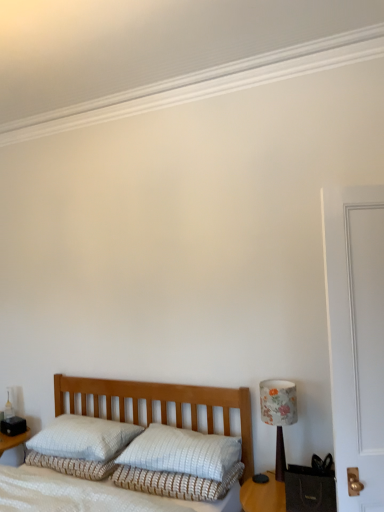
Question: Can you confirm if white textured bed at center is taller than white textured pillow at center, placed as the 1th pillow when sorted from left to right?

Choices:
 (A) yes
 (B) no

Answer: (A)

Question: From the image's perspective, is white textured bed at center on white textured pillow at center, placed as the 1th pillow when sorted from left to right?

Choices:
 (A) yes
 (B) no

Answer: (B)

Question: From a real-world perspective, is white textured bed at center located beneath white textured pillow at center, placed as the 1th pillow when sorted from left to right?

Choices:
 (A) yes
 (B) no

Answer: (A)

Question: Does white textured bed at center have a smaller size compared to white textured pillow at center, placed as the 1th pillow when sorted from left to right?

Choices:
 (A) yes
 (B) no

Answer: (B)

Question: Is white textured bed at center wider than white textured pillow at center, which is the 2th pillow from right to left?

Choices:
 (A) no
 (B) yes

Answer: (B)

Question: From a real-world perspective, is white textured bed at center on top of white textured pillow at center, placed as the 1th pillow when sorted from left to right?

Choices:
 (A) yes
 (B) no

Answer: (B)

Question: Is white textured pillow at center, which is the 2th pillow from right to left, positioned behind white textured pillow at center?

Choices:
 (A) yes
 (B) no

Answer: (A)

Question: From a real-world perspective, is white textured pillow at center, placed as the 1th pillow when sorted from left to right, on top of white textured pillow at center?

Choices:
 (A) no
 (B) yes

Answer: (B)

Question: From a real-world perspective, is white textured pillow at center, placed as the 1th pillow when sorted from left to right, positioned under white textured pillow at center based on gravity?

Choices:
 (A) no
 (B) yes

Answer: (A)

Question: Is white textured pillow at center, placed as the 1th pillow when sorted from left to right, shorter than white textured pillow at center?

Choices:
 (A) no
 (B) yes

Answer: (A)

Question: Would you say white textured pillow at center, placed as the 1th pillow when sorted from left to right, contains white textured pillow at center?

Choices:
 (A) yes
 (B) no

Answer: (B)

Question: Is white textured pillow at center, placed as the 1th pillow when sorted from left to right, looking in the opposite direction of white textured pillow at center?

Choices:
 (A) no
 (B) yes

Answer: (A)

Question: From the image's perspective, is white textured pillow at center, which is the 2th pillow from right to left, under floral fabric lampshade at right?

Choices:
 (A) no
 (B) yes

Answer: (B)